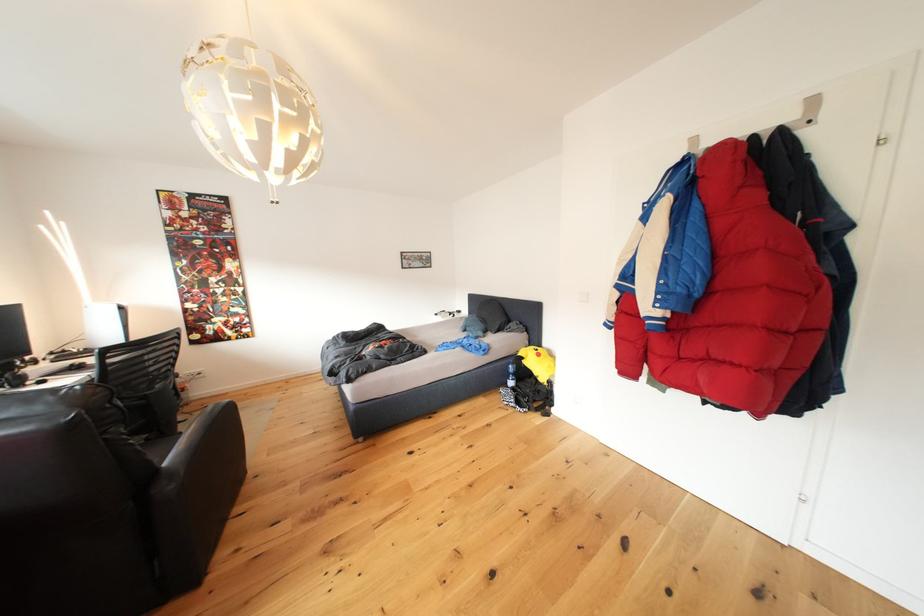
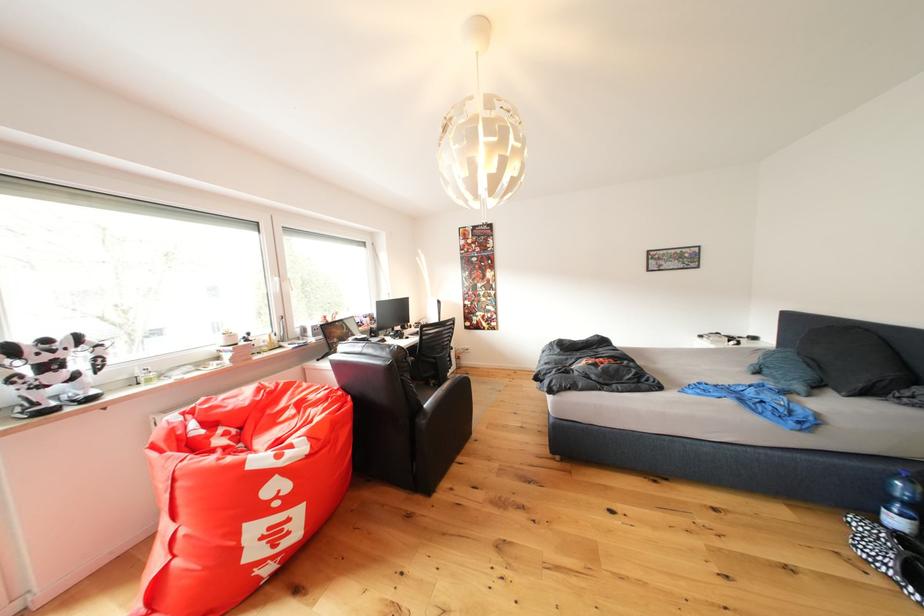
Find the pixel in the second image that matches (x=520, y=389) in the first image.

(906, 527)